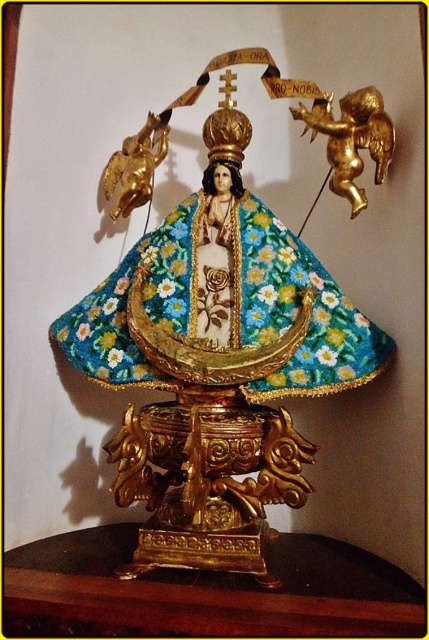
Question: Which object appears closest to the camera in this image?

Choices:
 (A) gold metallic cherub at upper right
 (B) gold/gilded cherub at upper left
 (C) gold textured statue at center
 (D) brown polished wood table at lower center

Answer: (D)

Question: Is brown polished wood table at lower center bigger than gold/gilded cherub at upper left?

Choices:
 (A) yes
 (B) no

Answer: (A)

Question: Is gold metallic cherub at upper right bigger than gold/gilded cherub at upper left?

Choices:
 (A) yes
 (B) no

Answer: (A)

Question: Which of the following is the closest to the observer?

Choices:
 (A) brown polished wood table at lower center
 (B) gold textured statue at center
 (C) gold metallic cherub at upper right
 (D) gold/gilded cherub at upper left

Answer: (A)

Question: Does brown polished wood table at lower center come in front of gold/gilded cherub at upper left?

Choices:
 (A) no
 (B) yes

Answer: (B)

Question: Which point appears closest to the camera in this image?

Choices:
 (A) (207, 186)
 (B) (105, 566)
 (C) (332, 122)
 (D) (129, 140)

Answer: (B)